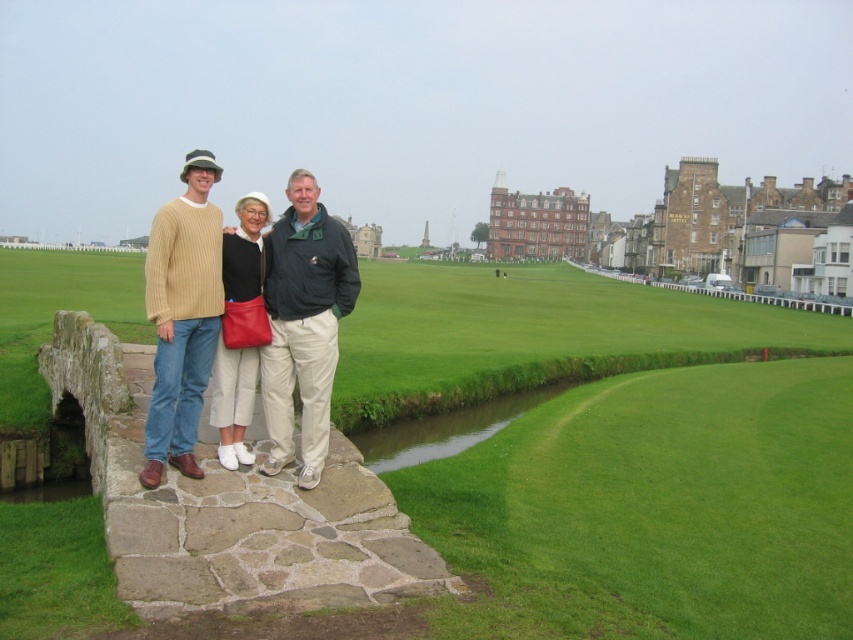
Does matte beige sweater at center lie behind dark green textured jacket at center?

That is False.

Can you confirm if matte beige sweater at center is positioned to the left of dark green textured jacket at center?

Yes, matte beige sweater at center is to the left of dark green textured jacket at center.

You are a GUI agent. You are given a task and a screenshot of the screen. Output one action in this format:
    pyautogui.click(x=<x>, y=<y>)
    Task: Click on the matte beige sweater at center
    
    Given the screenshot: What is the action you would take?
    pyautogui.click(x=199, y=314)

Locate an element on the screen. The image size is (853, 640). matte beige sweater at center is located at coordinates (199, 314).

Is green grass at center closer to the viewer compared to knit sweater at left?

Yes, green grass at center is closer to the viewer.

You are a GUI agent. You are given a task and a screenshot of the screen. Output one action in this format:
    pyautogui.click(x=<x>, y=<y>)
    Task: Click on the green grass at center
    The image size is (853, 640).
    Given the screenshot: What is the action you would take?
    [616, 452]

Is point (663, 548) behind point (144, 296)?

No, (663, 548) is in front of (144, 296).

I want to click on green grass at center, so click(616, 452).

Which is more to the left, matte beige sweater at center or knit sweater at left?

→ knit sweater at left is more to the left.

Between point (190, 184) and point (195, 412), which one is positioned in front?

Positioned in front is point (195, 412).

Locate an element on the screen. matte beige sweater at center is located at coordinates (199, 314).